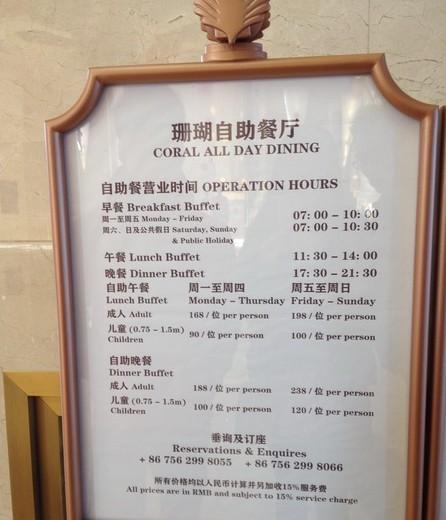
Find the location of a particular element. The image size is (446, 520). wall is located at coordinates (37, 286).